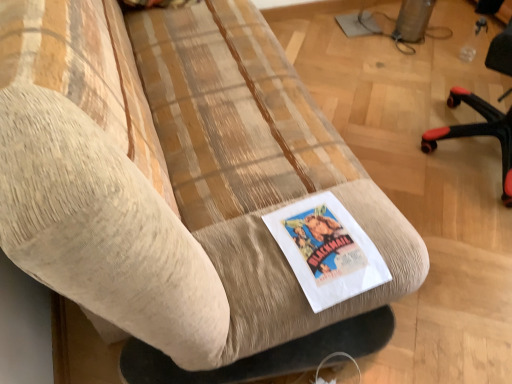
The image size is (512, 384). What do you see at coordinates (327, 250) in the screenshot? I see `white paper flyer at center` at bounding box center [327, 250].

Where is `white paper flyer at center`? white paper flyer at center is located at coordinates (327, 250).

This screenshot has height=384, width=512. What do you see at coordinates (478, 132) in the screenshot?
I see `black plastic chair at right` at bounding box center [478, 132].

What is the approximate width of black plastic chair at right?

21.53 inches.

This screenshot has height=384, width=512. In order to click on black plastic chair at right in this screenshot , I will do `click(478, 132)`.

The width and height of the screenshot is (512, 384). I want to click on white paper flyer at center, so click(327, 250).

Visually, is white paper flyer at center positioned to the left or to the right of black plastic chair at right?

From the image, it's evident that white paper flyer at center is to the left of black plastic chair at right.

Is white paper flyer at center positioned behind black plastic chair at right?

No, the depth of white paper flyer at center is less than that of black plastic chair at right.

Is point (342, 245) positioned before point (508, 122)?

Yes, it is.

From the image's perspective, which is below, white paper flyer at center or black plastic chair at right?

white paper flyer at center, from the image's perspective.

From a real-world perspective, is white paper flyer at center beneath black plastic chair at right?

Yes, from a real-world perspective, white paper flyer at center is under black plastic chair at right.

Which object is thinner, white paper flyer at center or black plastic chair at right?

Thinner between the two is white paper flyer at center.

Considering the relative sizes of white paper flyer at center and black plastic chair at right in the image provided, is white paper flyer at center shorter than black plastic chair at right?

Yes.

Does white paper flyer at center have a smaller size compared to black plastic chair at right?

Correct, white paper flyer at center occupies less space than black plastic chair at right.

Is white paper flyer at center positioned beyond the bounds of black plastic chair at right?

Indeed, white paper flyer at center is completely outside black plastic chair at right.

Is white paper flyer at center positioned far away from black plastic chair at right?

Yes.

Is white paper flyer at center oriented away from black plastic chair at right?

white paper flyer at center is not turned away from black plastic chair at right.

Identify the location of flyer located in front of the black plastic chair at right. The image size is (512, 384). (327, 250).

Based on their positions, is black plastic chair at right located to the left or right of white paper flyer at center?

Clearly, black plastic chair at right is on the right of white paper flyer at center in the image.

Considering the positions of objects black plastic chair at right and white paper flyer at center in the image provided, who is in front, black plastic chair at right or white paper flyer at center?

white paper flyer at center is closer to the camera.

Is point (488, 51) positioned in front of point (292, 213)?

No, (488, 51) is further to viewer.

From the image's perspective, between black plastic chair at right and white paper flyer at center, who is located below?

From the image's view, white paper flyer at center is below.

From a real-world perspective, is black plastic chair at right physically below white paper flyer at center?

No, from a real-world perspective, black plastic chair at right is not under white paper flyer at center.

In the scene shown: Which object is wider, black plastic chair at right or white paper flyer at center?

black plastic chair at right.

Which of these two, black plastic chair at right or white paper flyer at center, stands taller?

Standing taller between the two is black plastic chair at right.

Consider the image. Considering the relative sizes of black plastic chair at right and white paper flyer at center in the image provided, is black plastic chair at right smaller than white paper flyer at center?

Incorrect, black plastic chair at right is not smaller in size than white paper flyer at center.

Is white paper flyer at center completely or partially inside black plastic chair at right?

No, white paper flyer at center is not surrounded by black plastic chair at right.

Is black plastic chair at right beside white paper flyer at center?

black plastic chair at right is not next to white paper flyer at center, and they're not touching.

Is black plastic chair at right oriented away from white paper flyer at center?

black plastic chair at right is not turned away from white paper flyer at center.

Find the location of a particular element. This screenshot has width=512, height=384. chair above the white paper flyer at center (from the image's perspective) is located at coordinates click(x=478, y=132).

The width and height of the screenshot is (512, 384). What are the coordinates of `flyer lying on the left of black plastic chair at right` in the screenshot? It's located at (327, 250).

You are a GUI agent. You are given a task and a screenshot of the screen. Output one action in this format:
    pyautogui.click(x=<x>, y=<y>)
    Task: Click on the chair behind the white paper flyer at center
    
    Given the screenshot: What is the action you would take?
    pyautogui.click(x=478, y=132)